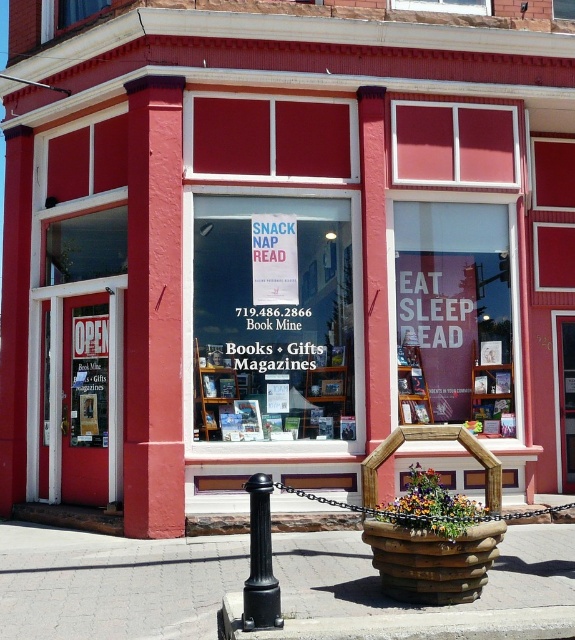
Question: Can you confirm if brick pavement at lower center is positioned to the right of black plastic pole at lower center?

Choices:
 (A) yes
 (B) no

Answer: (B)

Question: Which point appears farthest from the camera in this image?

Choices:
 (A) (156, 548)
 (B) (259, 604)

Answer: (A)

Question: Which point is closer to the camera?

Choices:
 (A) concrete at lower center
 (B) black plastic pole at lower center
 (C) brick pavement at lower center

Answer: (A)

Question: Which point is farther to the camera?

Choices:
 (A) black plastic pole at lower center
 (B) concrete at lower center

Answer: (A)

Question: Is brick pavement at lower center above black plastic pole at lower center?

Choices:
 (A) no
 (B) yes

Answer: (A)

Question: Is brick pavement at lower center wider than concrete at lower center?

Choices:
 (A) yes
 (B) no

Answer: (B)